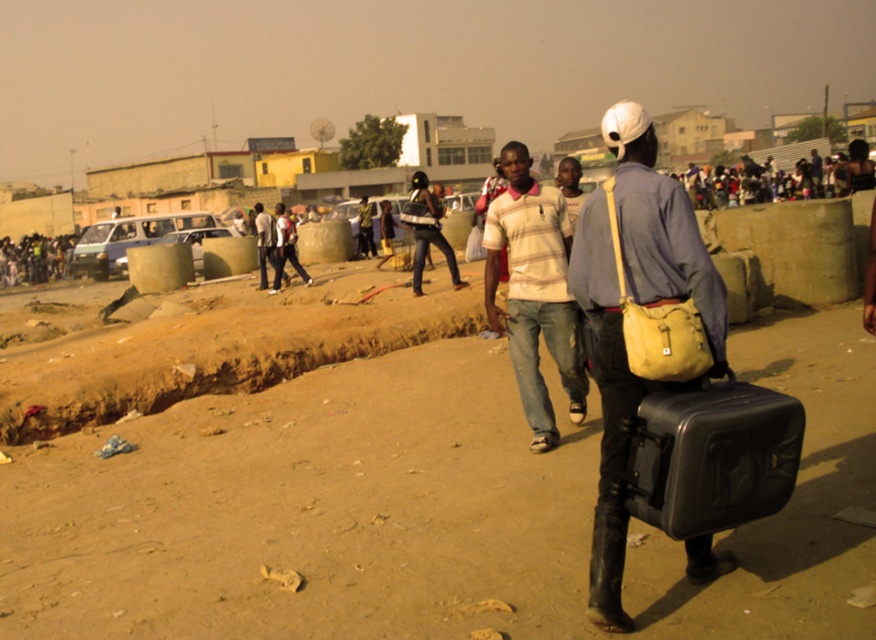
Consider the image. You are standing at the point labeled point (661, 499) and want to walk towards the point labeled point (617, 250). Which direction should you move relative to your current position?

You should move towards the point labeled point (617, 250), which is located behind you since point (661, 499) is closer to the viewer than point (617, 250).

You are a delivery person who needs to place both the black hard case at lower right and the yellow fabric bag at center onto a shelf that can only hold items up to 30 cm in height. Based on the scene, can both items fit on the shelf?

The black hard case at lower right has a lesser height compared to yellow fabric bag at center. Since the shelf can only hold items up to 30 cm in height, we need to check the height of both items. However, the exact heights are not provided. But since the black hard case is shorter than the yellow fabric bag, if the yellow fabric bag is under 30 cm, both can fit. If the yellow fabric bag exceeds 30 cm, only the black hard case would fit. Without specific measurements, we can only conclude that the black is